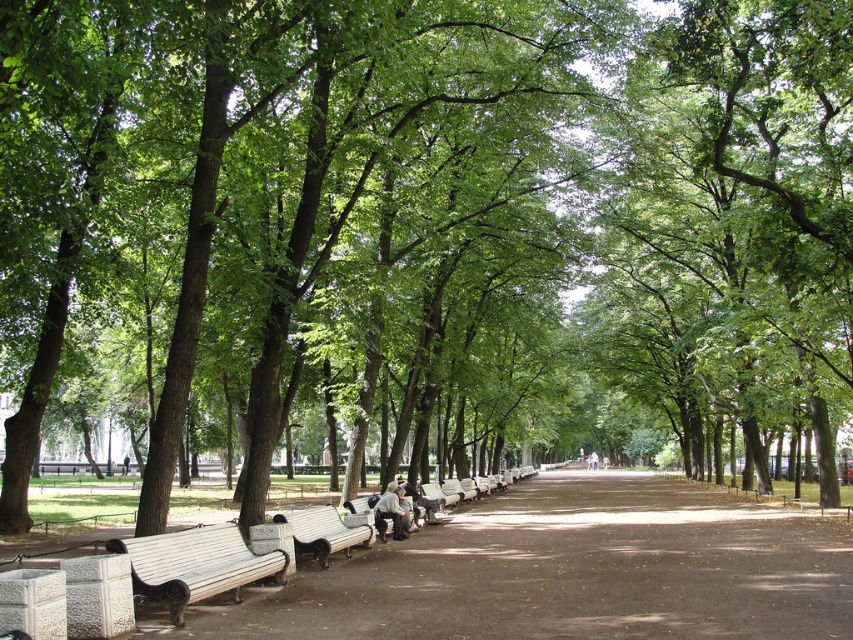
You are standing at the point labeled point (225, 547) and want to walk to the park entrance located at point 0.265, 0.856. Given that the park path is straight and the distance between these two points is 33.43 feet, how many steps would you need to take if each step covers approximately 2.5 feet?

The distance between the two points is 33.43 feet. Each step covers 2.5 feet, so dividing 33.43 by 2.5 gives approximately 13.37 steps. Since you can only take whole steps, you would need to take 14 steps to reach the park entrance.

You are planning to place a 1.5 meter long picnic blanket on one of the wooden benches. Which bench would allow the blanket to fit entirely without overlapping the edges? Please consider the width of the wooden bench at lower left and the wooden bench at center.

The wooden bench at center has a greater width than the wooden bench at lower left. Since the picnic blanket is 1.5 meters long, the wooden bench at center is wider and can accommodate the blanket without overlapping the edges.

You are a park visitor who wants to sit on the tallest bench available. Which bench should you choose between the wooden bench at lower left and the wooden bench at center?

The wooden bench at lower left is taller than the wooden bench at center, so you should choose the wooden bench at lower left.